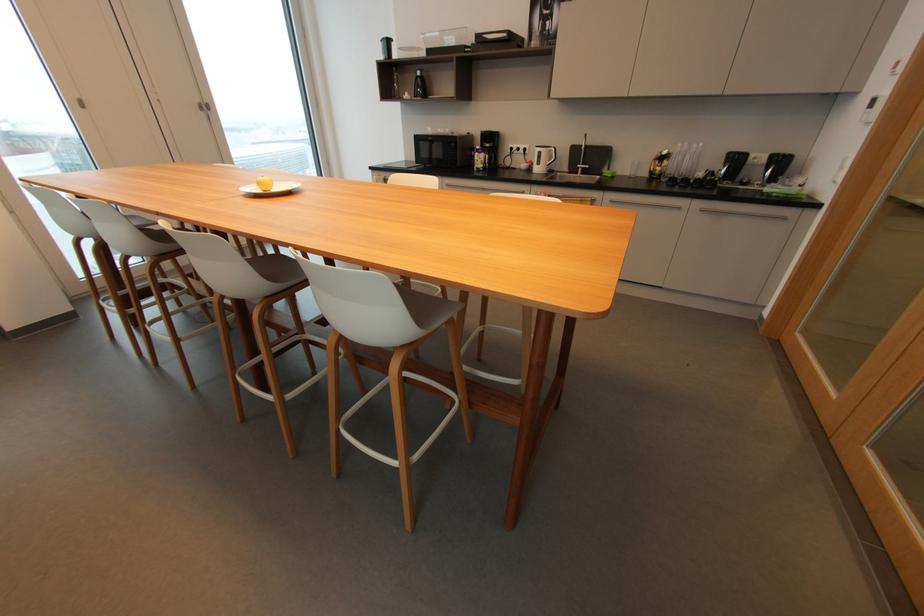
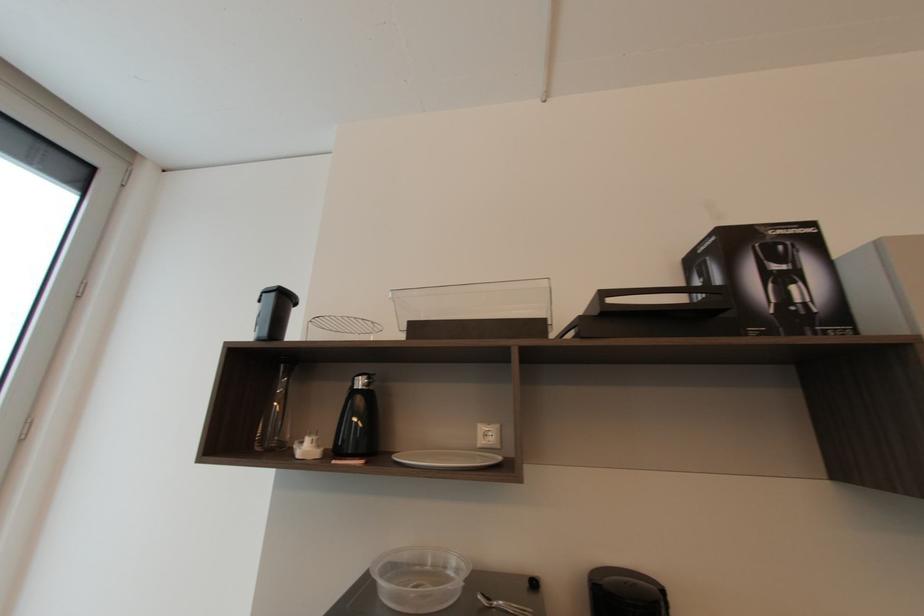
In the second image, find the point that corresponds to point (409, 95) in the first image.

(310, 447)